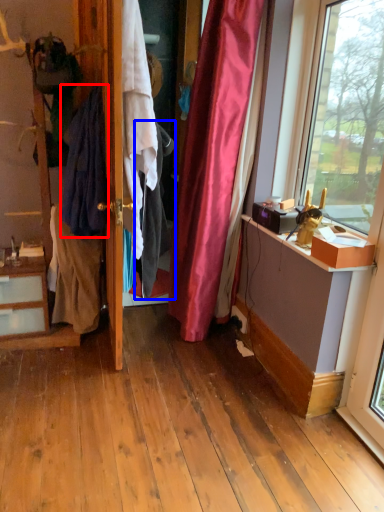
Question: Which point is closer to the camera, clothing (highlighted by a red box) or clothing (highlighted by a blue box)?

Choices:
 (A) clothing
 (B) clothing

Answer: (B)